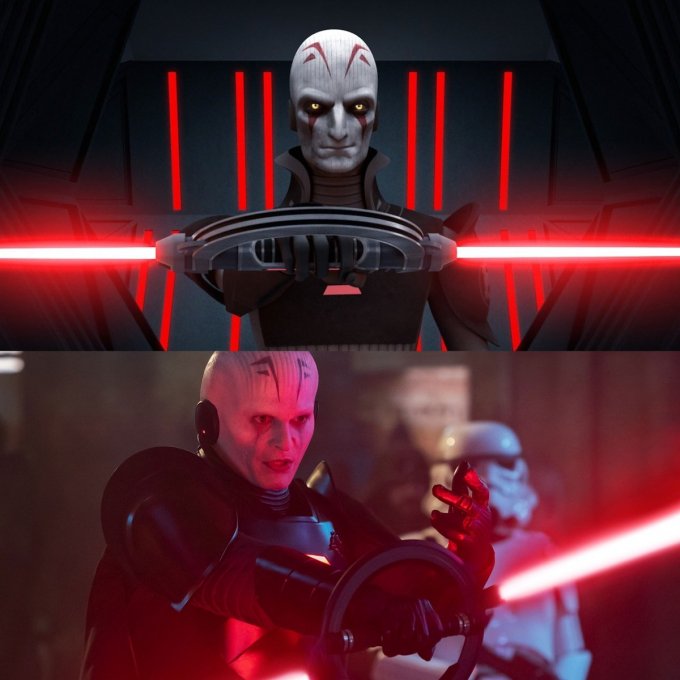
Image resolution: width=680 pixels, height=680 pixels. Find the location of `handles`. handles is located at coordinates (455, 624), (262, 256).